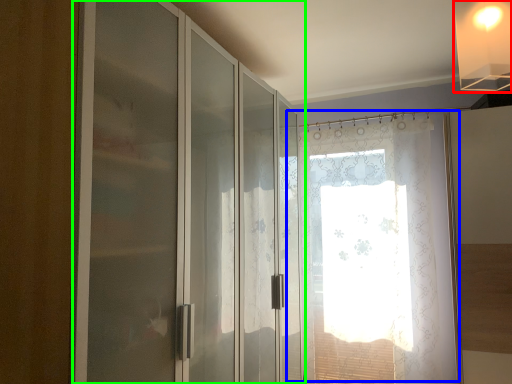
Question: Which object is the closest to the light fixture (highlighted by a red box)? Choose among these: window (highlighted by a blue box) or door (highlighted by a green box).

Choices:
 (A) window
 (B) door

Answer: (B)